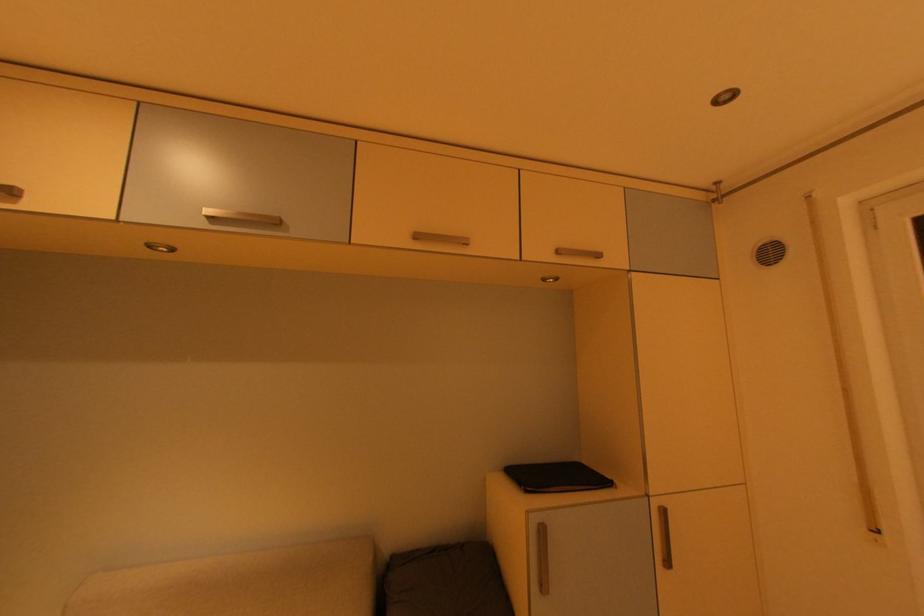
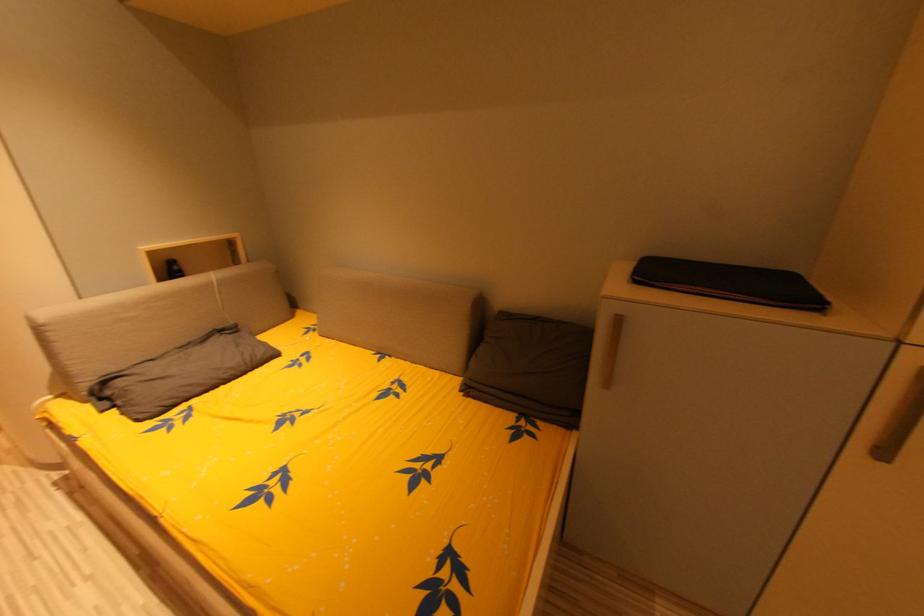
The first image is from the beginning of the video and the second image is from the end. How did the camera likely rotate when shooting the video?

The rotation direction of the camera is left-down.